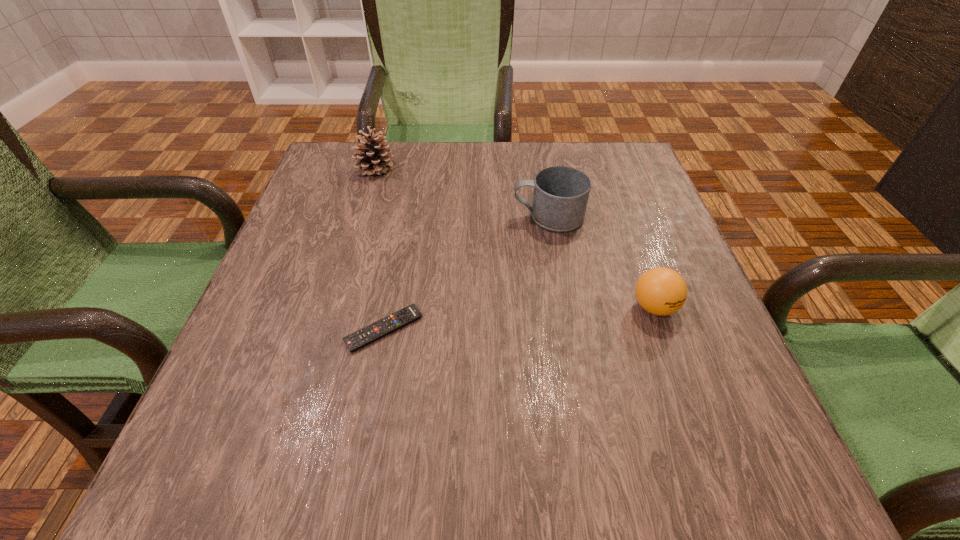
Find the location of a particular element. The image size is (960, 540). the farthest object is located at coordinates (375, 159).

Locate an element on the screen. the third object from left to right is located at coordinates (560, 198).

Where is `mug`? mug is located at coordinates (560, 198).

Where is `ping-pong ball`? The image size is (960, 540). ping-pong ball is located at coordinates (661, 291).

Locate an element on the screen. This screenshot has height=540, width=960. the shortest object is located at coordinates (354, 341).

What are the coordinates of `vacant space located on the front of the farthest object` in the screenshot? It's located at (362, 212).

Locate an element on the screen. The height and width of the screenshot is (540, 960). vacant region located 0.170m on the side of the second object from right to left with the handle is located at coordinates (437, 216).

Where is `free space located 0.130m on the side of the second object from right to left with the handle`? free space located 0.130m on the side of the second object from right to left with the handle is located at coordinates (455, 216).

You are a GUI agent. You are given a task and a screenshot of the screen. Output one action in this format:
    pyautogui.click(x=<x>, y=<y>)
    Task: Click on the free space located on the side of the second object from right to left with the handle
    Image resolution: width=960 pixels, height=540 pixels.
    Given the screenshot: What is the action you would take?
    pyautogui.click(x=486, y=216)

At what (x,y) coordinates should I click in order to perform the action: click on vacant space located on the side with brand of the ping-pong ball. Please return your answer as a coordinate pair (x, y). Looking at the image, I should click on (715, 478).